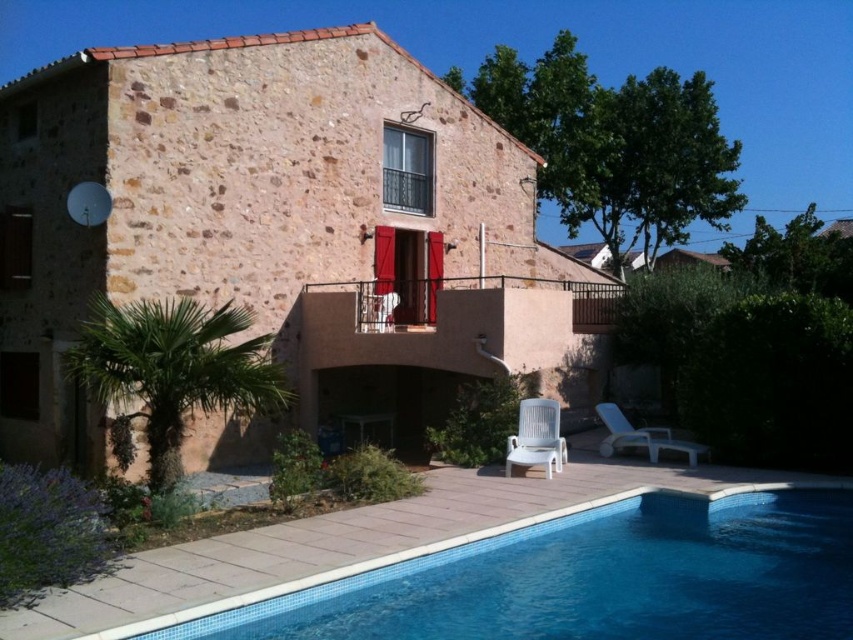
Question: Which point is closer to the camera taking this photo?

Choices:
 (A) (27, 141)
 (B) (844, 509)
 (C) (561, 461)

Answer: (B)

Question: Does brown stone villa at center come in front of white plastic lounge chair at lower right?

Choices:
 (A) yes
 (B) no

Answer: (A)

Question: Can you confirm if white plastic chair at lower right is positioned to the left of white plastic lounge chair at lower right?

Choices:
 (A) no
 (B) yes

Answer: (B)

Question: Is the position of white plastic chair at lower right more distant than that of white plastic lounge chair at lower right?

Choices:
 (A) yes
 (B) no

Answer: (B)

Question: Which object appears closest to the camera in this image?

Choices:
 (A) white plastic chair at lower right
 (B) white plastic lounge chair at lower right
 (C) blue tile swimming pool at lower center
 (D) brown stone villa at center

Answer: (C)

Question: Which object is farther from the camera taking this photo?

Choices:
 (A) brown stone villa at center
 (B) white plastic lounge chair at lower right

Answer: (B)